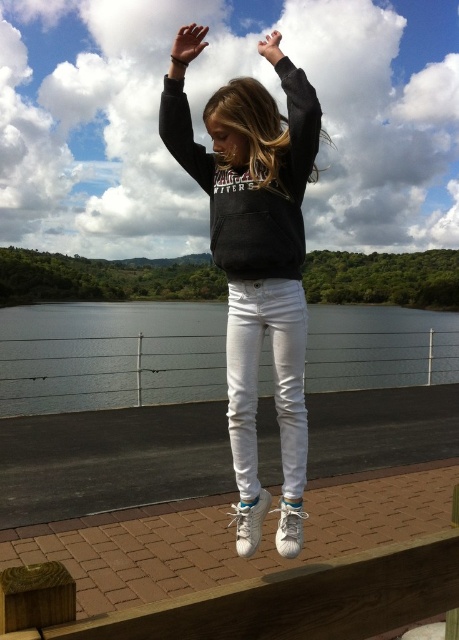
You are a photographer observing the scene. You notice two hands in the image, the brown leather hand at upper center and the white matte hand at upper center. Which hand appears wider in the photo?

The brown leather hand at upper center appears wider than the white matte hand at upper center as stated in the description.

You are a photographer trying to capture the perfect shot of the jumping person. You notice the black matte sweatshirt at upper center and the white matte hand at upper center. Which object is positioned lower in the image?

The black matte sweatshirt at upper center has a lesser height compared to the white matte hand at upper center, so the black matte sweatshirt at upper center is positioned lower in the image.

You are a photographer trying to capture the perfect shot of the jumping person. You notice two points in the image labeled as point (x=325, y=138) and point (x=279, y=49). Which point should you focus on to ensure the subject stays in focus if you want to capture the moment when the person reaches the highest point of their jump?

Point (x=279, y=49) should be focused on because it is in front of point (x=325, y=138), which is closer to the camera and likely where the person is at the peak of their jump.